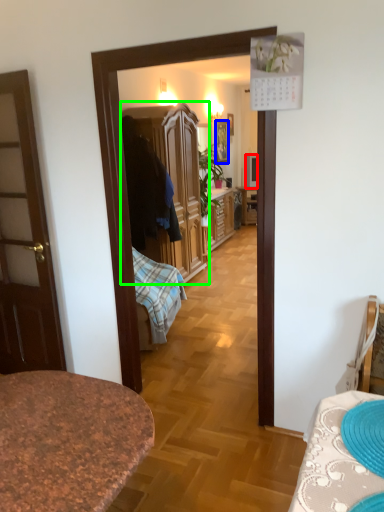
Question: Based on their relative distances, which object is nearer to television (highlighted by a red box)? Choose from picture frame (highlighted by a blue box) and cabinetry (highlighted by a green box).

Choices:
 (A) picture frame
 (B) cabinetry

Answer: (A)